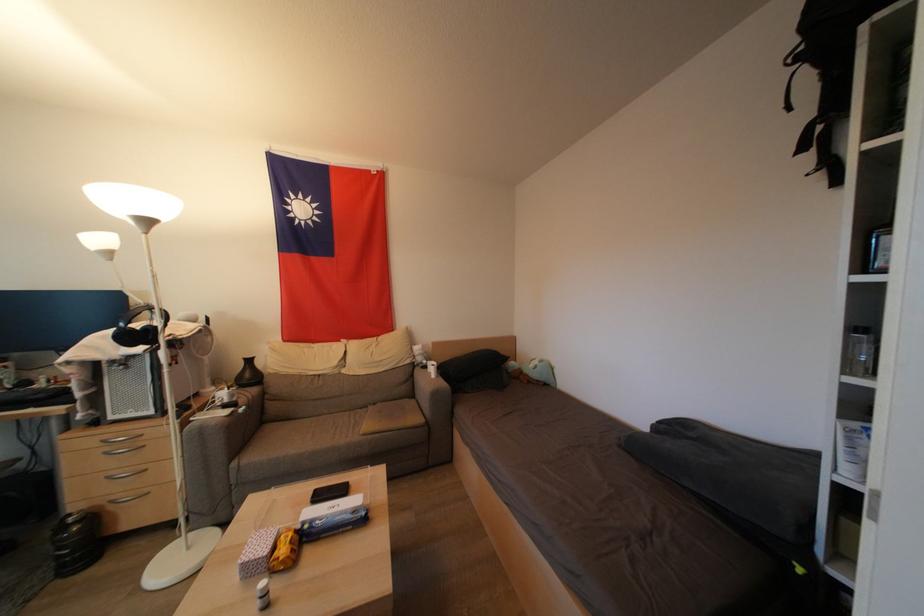
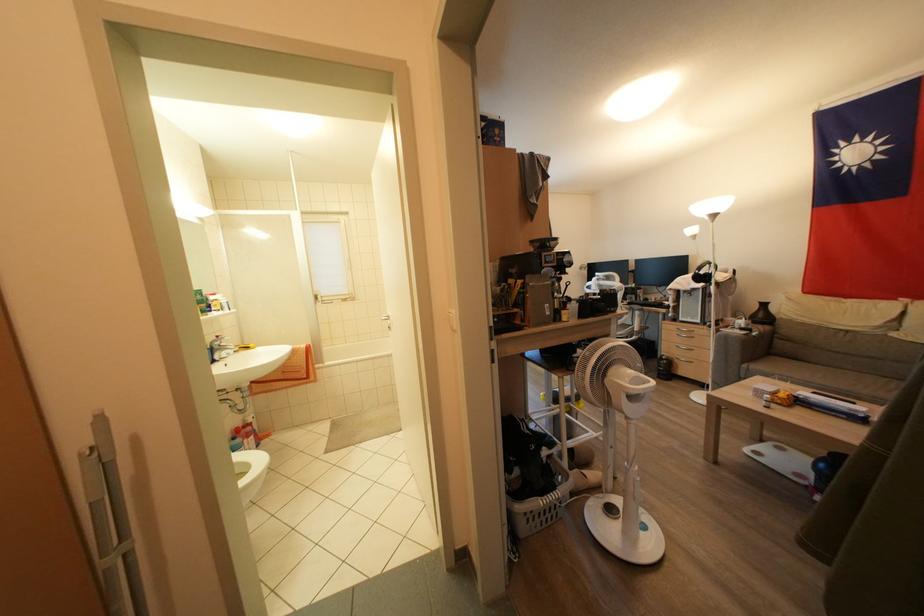
The point at (359, 515) is marked in the first image. Where is the corresponding point in the second image?

(858, 415)